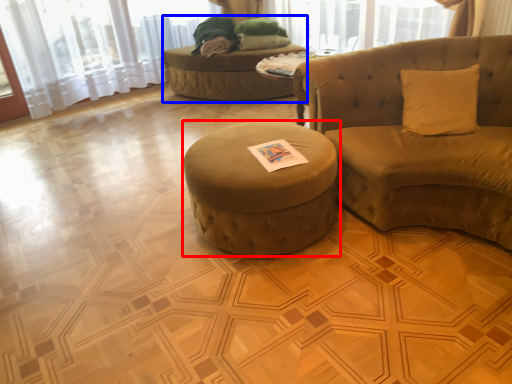
Question: Among these objects, which one is farthest to the camera, table (highlighted by a red box) or bean bag chair (highlighted by a blue box)?

Choices:
 (A) table
 (B) bean bag chair

Answer: (B)